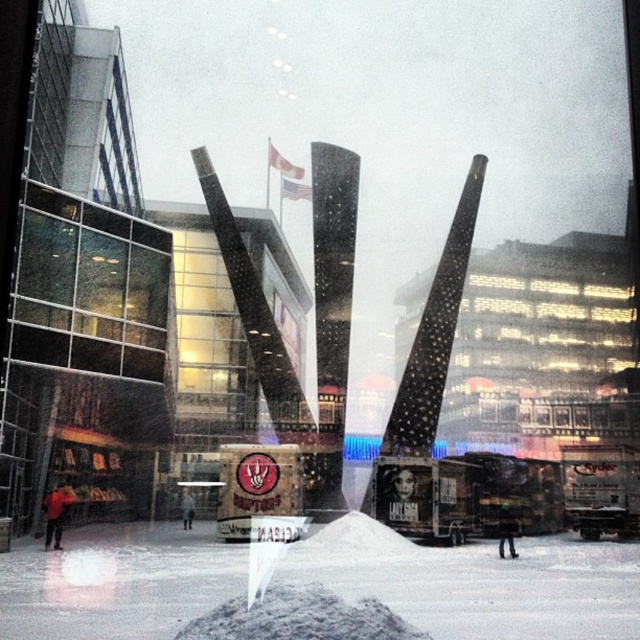
Question: Which point is closer to the camera taking this photo?

Choices:
 (A) (355, 636)
 (B) (28, 595)

Answer: (A)

Question: Does white powdery snow at lower center appear over gray gravel mound at center?

Choices:
 (A) yes
 (B) no

Answer: (B)

Question: Which of the following is the closest to the observer?

Choices:
 (A) gray gravel mound at center
 (B) white powdery snow at lower center

Answer: (A)

Question: Does white powdery snow at lower center have a larger size compared to gray gravel mound at center?

Choices:
 (A) no
 (B) yes

Answer: (B)

Question: Which object appears closest to the camera in this image?

Choices:
 (A) gray gravel mound at center
 (B) white powdery snow at lower center

Answer: (A)

Question: Does white powdery snow at lower center appear on the left side of gray gravel mound at center?

Choices:
 (A) yes
 (B) no

Answer: (B)